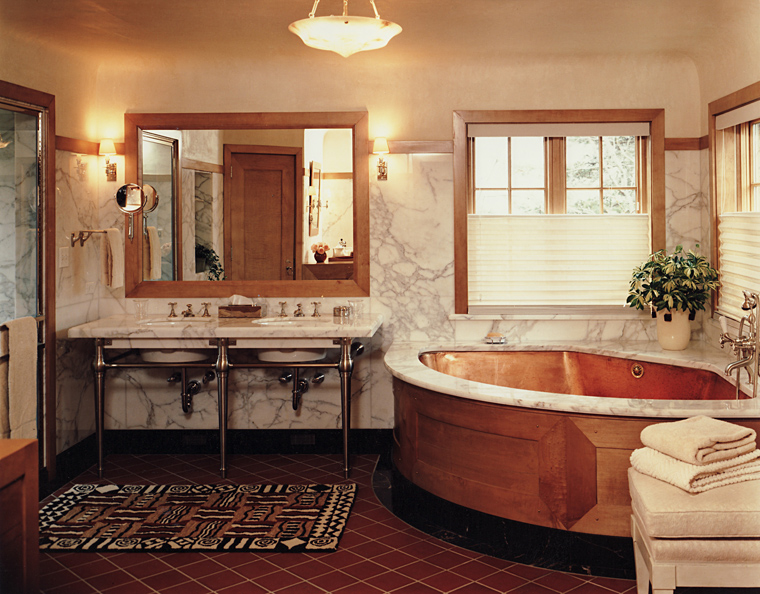
Identify the location of rug. The height and width of the screenshot is (594, 760). (150, 502).